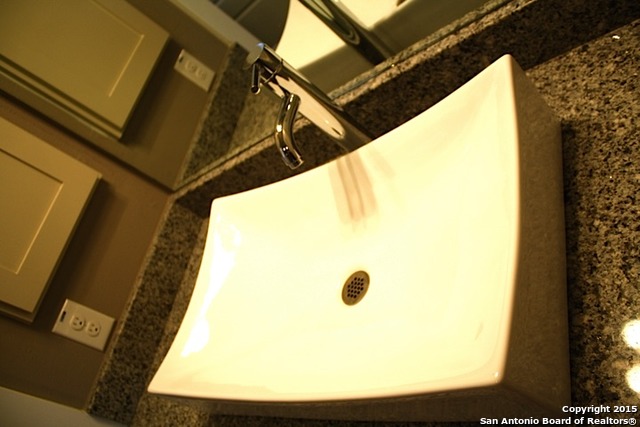
This screenshot has height=427, width=640. I want to click on mirror, so click(x=182, y=104).